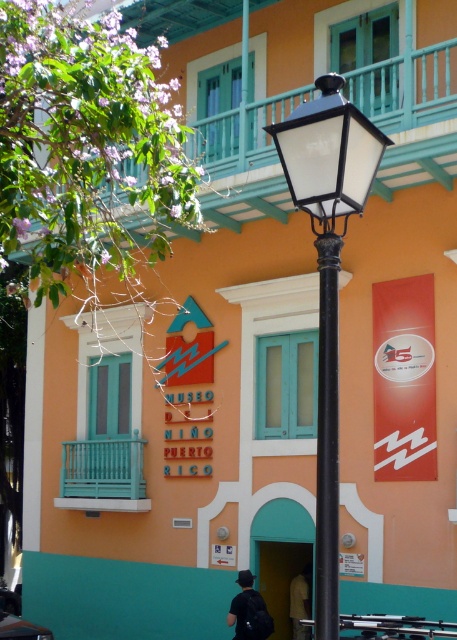
Question: Which object appears farthest from the camera in this image?

Choices:
 (A) black metal pole at center
 (B) dark gray fabric shirt at lower center
 (C) black fabric backpack at lower center
 (D) black matte street light at center

Answer: (B)

Question: Among these points, which one is nearest to the camera?

Choices:
 (A) (327, 497)
 (B) (334, 602)

Answer: (B)

Question: Is black matte street light at center positioned in front of dark gray fabric shirt at lower center?

Choices:
 (A) yes
 (B) no

Answer: (A)

Question: Which of the following is the closest to the observer?

Choices:
 (A) dark gray fabric shirt at lower center
 (B) black metal pole at center

Answer: (B)

Question: Where is black matte street light at center located in relation to black fabric backpack at lower center in the image?

Choices:
 (A) above
 (B) below

Answer: (A)

Question: Is black matte street light at center thinner than black metal pole at center?

Choices:
 (A) no
 (B) yes

Answer: (A)